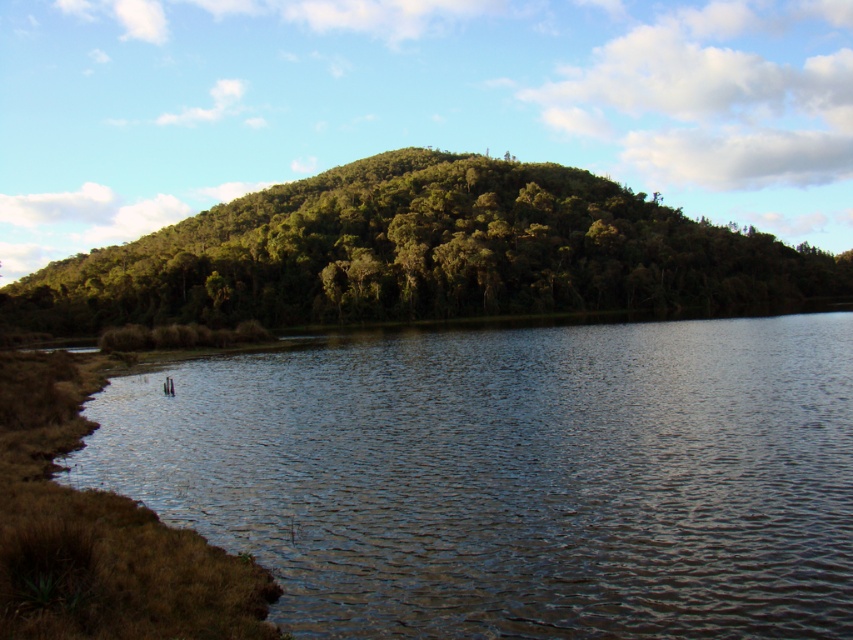
Question: Is clear water at lower left below green leafy trees at center?

Choices:
 (A) yes
 (B) no

Answer: (A)

Question: Does clear water at lower left appear on the left side of green leafy trees at center?

Choices:
 (A) yes
 (B) no

Answer: (B)

Question: Does clear water at lower left have a greater width compared to green leafy trees at center?

Choices:
 (A) yes
 (B) no

Answer: (B)

Question: Which of the following is the closest to the observer?

Choices:
 (A) clear water at lower left
 (B) green leafy trees at center

Answer: (A)